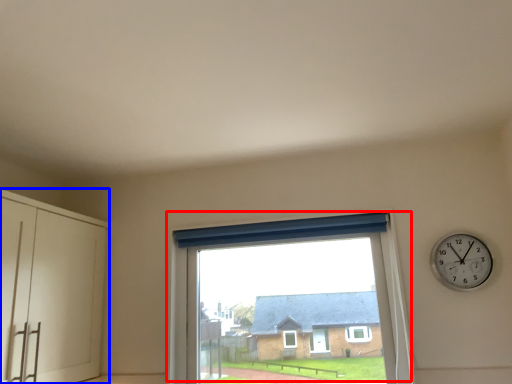
Question: Among these objects, which one is nearest to the camera, window (highlighted by a red box) or dresser (highlighted by a blue box)?

Choices:
 (A) window
 (B) dresser

Answer: (B)